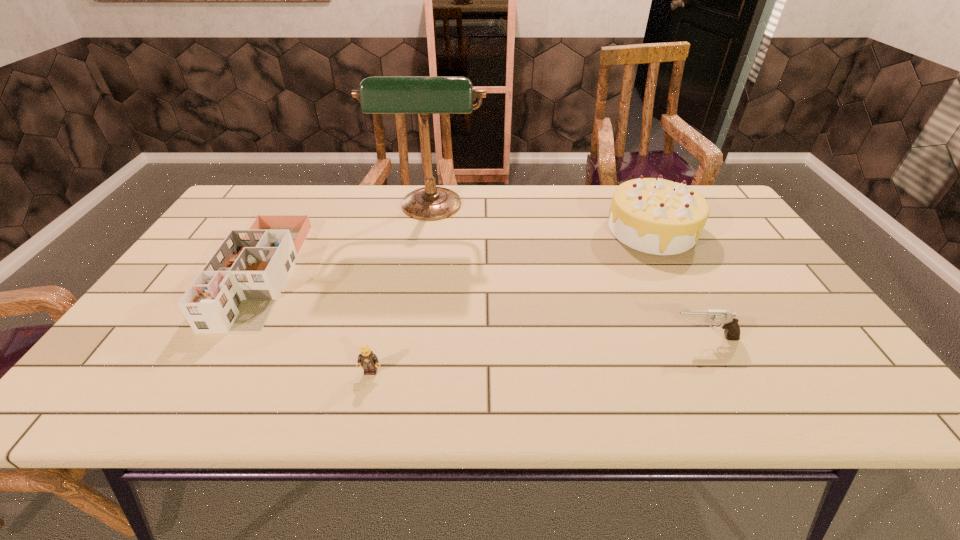
This screenshot has width=960, height=540. I want to click on vacant space at the left edge of the desktop, so click(x=143, y=326).

Locate an element on the screen. free point at the right edge is located at coordinates (780, 346).

The image size is (960, 540). Find the location of `vacant region at the far left corner of the desktop`. vacant region at the far left corner of the desktop is located at coordinates (271, 201).

The width and height of the screenshot is (960, 540). In the image, there is a desktop. In order to click on vacant space at the near left corner in this screenshot , I will do `click(158, 377)`.

This screenshot has height=540, width=960. Find the location of `unoccupied position between the leftmost object and the tallest object`. unoccupied position between the leftmost object and the tallest object is located at coordinates (347, 241).

Where is `vacant space in between the second nearest object and the leftmost object`? This screenshot has width=960, height=540. vacant space in between the second nearest object and the leftmost object is located at coordinates (483, 306).

Image resolution: width=960 pixels, height=540 pixels. Find the location of `free spot between the birthday cake and the dollhouse`. free spot between the birthday cake and the dollhouse is located at coordinates (457, 252).

Find the location of `free spot between the gun and the fourth shortest object`. free spot between the gun and the fourth shortest object is located at coordinates (678, 284).

I want to click on free space between the dollhouse and the table lamp, so click(x=347, y=241).

Locate an element on the screen. The width and height of the screenshot is (960, 540). empty space between the tallest object and the Lego is located at coordinates (401, 291).